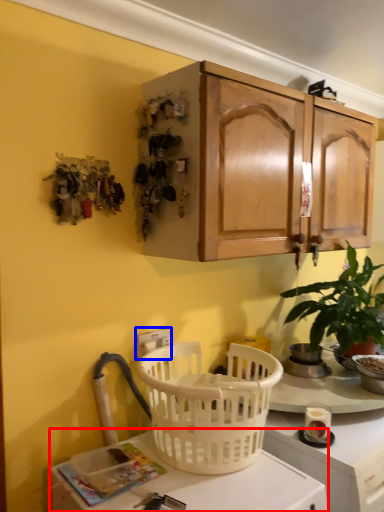
Question: Which point is closer to the camera, desk (highlighted by a red box) or electric outlet (highlighted by a blue box)?

Choices:
 (A) desk
 (B) electric outlet

Answer: (A)